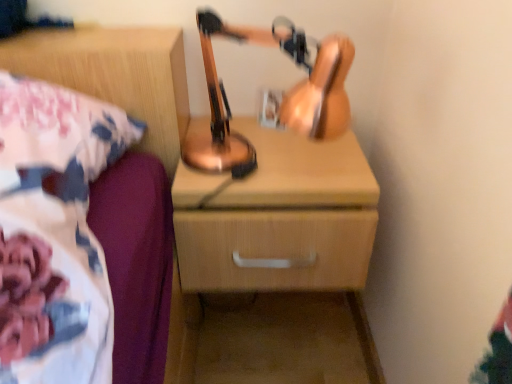
The width and height of the screenshot is (512, 384). What do you see at coordinates (279, 218) in the screenshot? I see `wooden chest of drawers at center` at bounding box center [279, 218].

Where is `wooden chest of drawers at center`? wooden chest of drawers at center is located at coordinates (279, 218).

Find the location of a particular element. This screenshot has height=384, width=512. the chest of drawers that appears behind the wooden nightstand at upper right is located at coordinates 279,218.

From a real-world perspective, is wooden nightstand at upper right positioned above or below wooden chest of drawers at center?

wooden nightstand at upper right is situated higher than wooden chest of drawers at center in the real world.

Considering their positions, is wooden nightstand at upper right located in front of or behind wooden chest of drawers at center?

In the image, wooden nightstand at upper right appears in front of wooden chest of drawers at center.

Are wooden nightstand at upper right and wooden chest of drawers at center far apart?

wooden nightstand at upper right is actually quite close to wooden chest of drawers at center.

Is wooden chest of drawers at center completely or partially inside copper metallic table lamp at center?

No, copper metallic table lamp at center does not contain wooden chest of drawers at center.

Is copper metallic table lamp at center facing towards wooden chest of drawers at center?

No, copper metallic table lamp at center does not turn towards wooden chest of drawers at center.

From the image's perspective, would you say copper metallic table lamp at center is shown under wooden chest of drawers at center?

No, from the image's perspective, copper metallic table lamp at center is not below wooden chest of drawers at center.

I want to click on nightstand below the copper metallic table lamp at center (from the image's perspective), so click(116, 74).

Measure the distance from wooden nightstand at upper right to copper metallic table lamp at center.

wooden nightstand at upper right is 7.70 inches away from copper metallic table lamp at center.

How many degrees apart are the facing directions of wooden nightstand at upper right and copper metallic table lamp at center?

There is a 0.649-degree angle between the facing directions of wooden nightstand at upper right and copper metallic table lamp at center.

From a real-world perspective, is wooden nightstand at upper right located beneath copper metallic table lamp at center?

Yes.

Looking at this image, would you say copper metallic table lamp at center is inside or outside wooden nightstand at upper right?

copper metallic table lamp at center lies outside wooden nightstand at upper right.

Can you confirm if copper metallic table lamp at center is positioned to the left of wooden nightstand at upper right?

Incorrect, copper metallic table lamp at center is not on the left side of wooden nightstand at upper right.

Is copper metallic table lamp at center aimed at wooden nightstand at upper right?

No.

Relative to wooden nightstand at upper right, is copper metallic table lamp at center in front or behind?

Visually, copper metallic table lamp at center is located behind wooden nightstand at upper right.

Does wooden chest of drawers at center have a smaller size compared to wooden nightstand at upper right?

Incorrect, wooden chest of drawers at center is not smaller in size than wooden nightstand at upper right.

Can you confirm if wooden chest of drawers at center is taller than wooden nightstand at upper right?

Yes, wooden chest of drawers at center is taller than wooden nightstand at upper right.

Considering the sizes of wooden chest of drawers at center and wooden nightstand at upper right in the image, is wooden chest of drawers at center wider or thinner than wooden nightstand at upper right?

Considering their sizes, wooden chest of drawers at center looks slimmer than wooden nightstand at upper right.

Measure the distance from wooden chest of drawers at center to wooden nightstand at upper right.

wooden chest of drawers at center is 23.05 centimeters away from wooden nightstand at upper right.

Are wooden chest of drawers at center and copper metallic table lamp at center far apart?

No, wooden chest of drawers at center is in close proximity to copper metallic table lamp at center.

Looking at this image, from a real-world perspective, does wooden chest of drawers at center sit lower than copper metallic table lamp at center?

Yes, from a real-world perspective, wooden chest of drawers at center is under copper metallic table lamp at center.

In terms of width, does wooden chest of drawers at center look wider or thinner when compared to copper metallic table lamp at center?

Clearly, wooden chest of drawers at center has more width compared to copper metallic table lamp at center.

Is point (270, 261) closer to camera compared to point (330, 61)?

That is False.

At what (x,y) coordinates should I click in order to perform the action: click on nightstand that is above the wooden chest of drawers at center (from the image's perspective). Please return your answer as a coordinate pair (x, y). Image resolution: width=512 pixels, height=384 pixels. Looking at the image, I should click on (116, 74).

Where is `the chest of drawers below the copper metallic table lamp at center (from the image's perspective)`? Image resolution: width=512 pixels, height=384 pixels. the chest of drawers below the copper metallic table lamp at center (from the image's perspective) is located at coordinates (279, 218).

When comparing their distances from copper metallic table lamp at center, does wooden chest of drawers at center or wooden nightstand at upper right seem further?

The object further to copper metallic table lamp at center is wooden nightstand at upper right.

Based on their spatial positions, is wooden nightstand at upper right or wooden chest of drawers at center closer to copper metallic table lamp at center?

wooden chest of drawers at center lies closer to copper metallic table lamp at center than the other object.

Considering their positions, is copper metallic table lamp at center positioned further to wooden chest of drawers at center than wooden nightstand at upper right?

wooden nightstand at upper right is further to wooden chest of drawers at center.

Looking at this image, which object lies further to the anchor point wooden nightstand at upper right, copper metallic table lamp at center or wooden chest of drawers at center?

wooden chest of drawers at center.

Looking at the image, which one is located closer to wooden chest of drawers at center, wooden nightstand at upper right or copper metallic table lamp at center?

copper metallic table lamp at center is closer to wooden chest of drawers at center.

Estimate the real-world distances between objects in this image. Which object is closer to wooden nightstand at upper right, wooden chest of drawers at center or copper metallic table lamp at center?

The object closer to wooden nightstand at upper right is copper metallic table lamp at center.

What are the coordinates of `table lamp situated between wooden nightstand at upper right and wooden chest of drawers at center from left to right` in the screenshot? It's located at (269, 94).